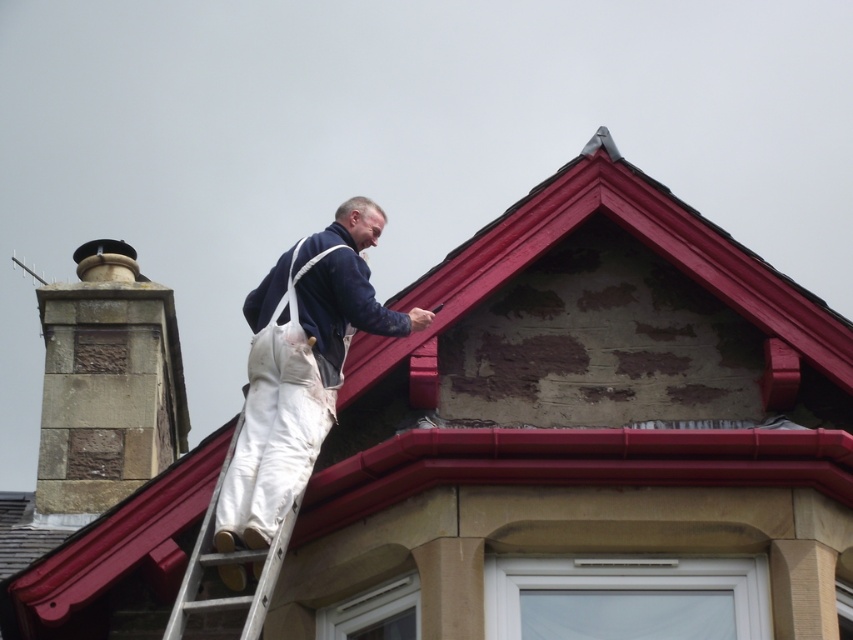
You are a painter standing on the ground and looking at the white canvas overalls at upper center and the white fabric ladder at center. Which object is nearer to you?

The white canvas overalls at upper center is closer to the viewer than the white fabric ladder at center.

You are a painter standing on the ladder. You need to reach the white canvas overalls at upper center to touch up a spot. However, you notice the brown stone chimney at left might be in the way. Is the chimney positioned above or below the overalls?

The brown stone chimney at left is located below the white canvas overalls at upper center, so it is not blocking the path to the overalls.